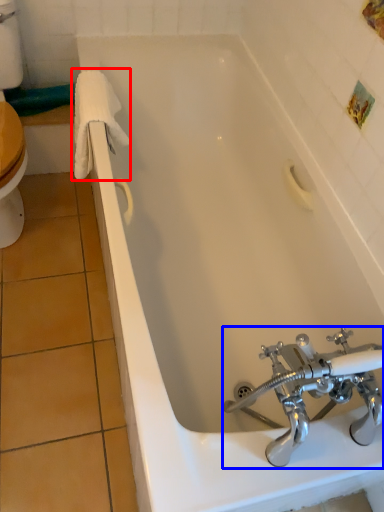
Question: Which object appears farthest to the camera in this image, bath towel (highlighted by a red box) or tap (highlighted by a blue box)?

Choices:
 (A) bath towel
 (B) tap

Answer: (A)